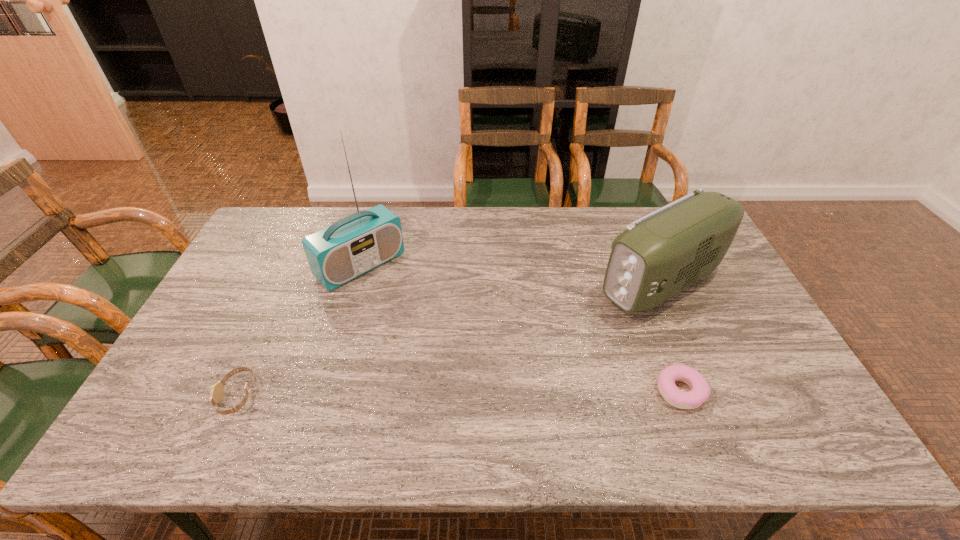
Locate an element on the screen. This screenshot has height=540, width=960. watch is located at coordinates (217, 390).

Where is `pastry`? The height and width of the screenshot is (540, 960). pastry is located at coordinates (700, 391).

Identify the location of the third shortest object. This screenshot has width=960, height=540. (660, 254).

The height and width of the screenshot is (540, 960). In order to click on the right radio receiver in this screenshot , I will do `click(660, 254)`.

Where is `the taller radio receiver`? The width and height of the screenshot is (960, 540). the taller radio receiver is located at coordinates (358, 243).

Locate an element on the screen. The height and width of the screenshot is (540, 960). the tallest object is located at coordinates (358, 243).

The height and width of the screenshot is (540, 960). I want to click on free location located on the face of the leftmost object, so click(192, 395).

Where is `vacant space situated 0.150m on the face of the leftmost object`? Image resolution: width=960 pixels, height=540 pixels. vacant space situated 0.150m on the face of the leftmost object is located at coordinates (159, 395).

Image resolution: width=960 pixels, height=540 pixels. I want to click on vacant space located 0.110m on the face of the leftmost object, so click(x=176, y=395).

At what (x,y) coordinates should I click in order to perform the action: click on vacant space located 0.120m on the back of the shortest object. Please return your answer as a coordinate pair (x, y). Looking at the image, I should click on (x=660, y=335).